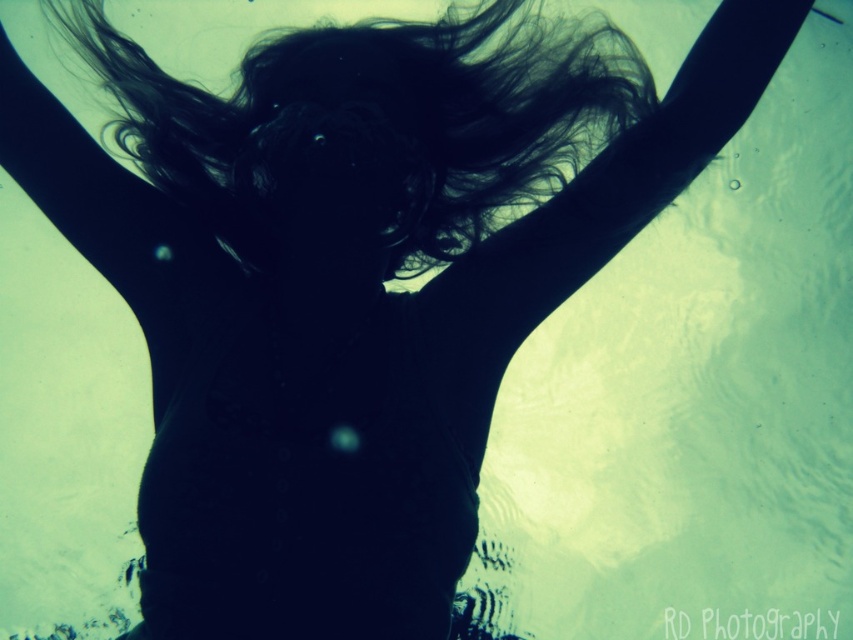
You are a swimmer trying to locate your hair underwater. According to the image, where exactly is the black silky hair at center located?

The black silky hair at center is located at point (369, 128).

You are a diver swimming underwater and see two points marked in the scene. If you move forward, which point will you encounter first, point (631, 49) or point (717, 150)?

Point (717, 150) will be encountered first because it is closer to the diver than point (631, 49), which is behind it.

You are a photographer analyzing an underwater scene. You notice two distinct strands of hair in the image, one labeled as black silky hair at center and the other as black matte hair at upper center. Which strand of hair appears larger in size?

The black silky hair at center is bigger than the black matte hair at upper center.